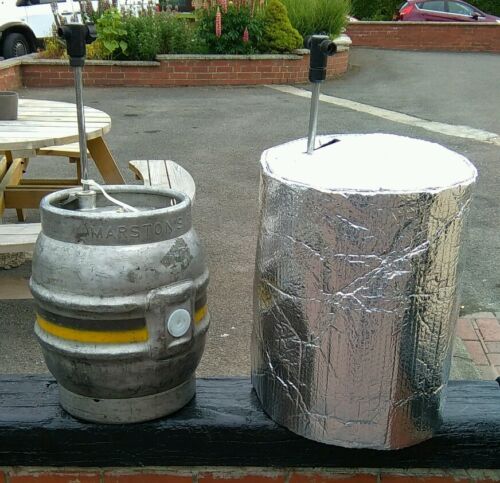
Image resolution: width=500 pixels, height=483 pixels. I want to click on table seat, so click(12, 242).